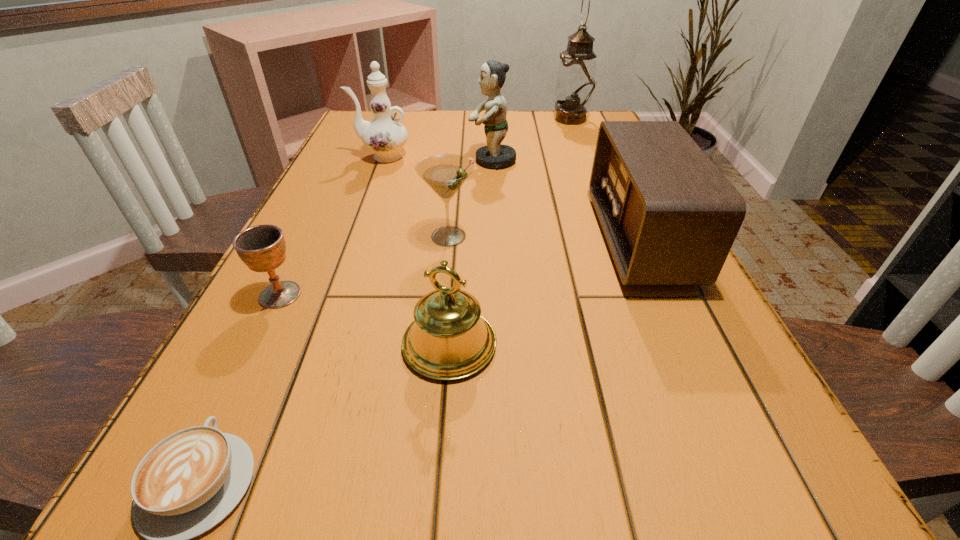
The width and height of the screenshot is (960, 540). I want to click on unoccupied position between the radio receiver and the martini, so click(x=544, y=238).

Locate an element on the screen. This screenshot has width=960, height=540. free space between the radio receiver and the martini is located at coordinates (544, 238).

Where is `free spot between the bell and the chinaware`? The image size is (960, 540). free spot between the bell and the chinaware is located at coordinates pos(416,251).

Find the location of a particular element. The width and height of the screenshot is (960, 540). free spot between the farthest object and the martini is located at coordinates (510, 178).

Locate an element on the screen. The width and height of the screenshot is (960, 540). free space between the figurine and the second shortest object is located at coordinates (386, 228).

The width and height of the screenshot is (960, 540). I want to click on empty location between the radio receiver and the figurine, so click(566, 200).

Where is `object that can be found as the second closest to the martini`? object that can be found as the second closest to the martini is located at coordinates (x=262, y=248).

I want to click on object that is the second closest one to the bell, so click(x=190, y=481).

Where is `blank area in the image that satisfies the following two spatial constraints: 1. on the back side of the seventh tallest object; 2. on the right side of the martini`? blank area in the image that satisfies the following two spatial constraints: 1. on the back side of the seventh tallest object; 2. on the right side of the martini is located at coordinates (309, 237).